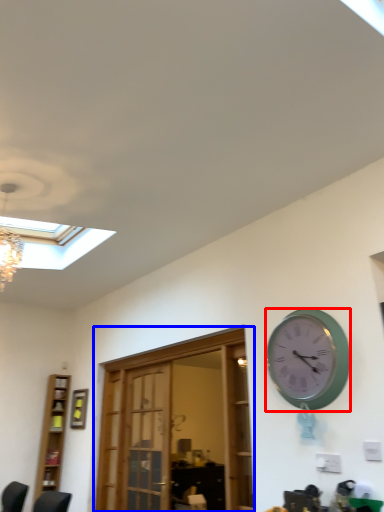
Question: Which of the following is the closest to the observer, wall clock (highlighted by a red box) or door (highlighted by a blue box)?

Choices:
 (A) wall clock
 (B) door

Answer: (A)